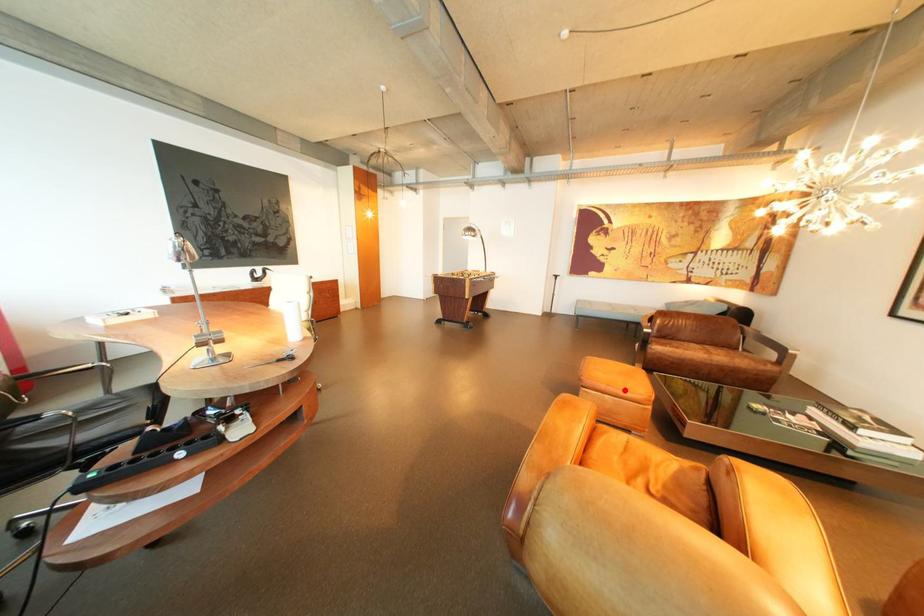
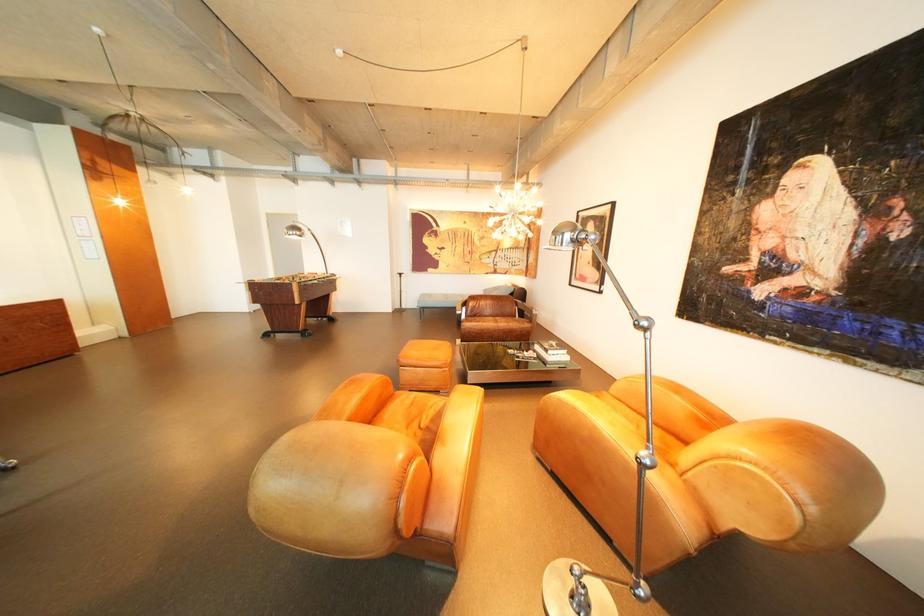
Locate, in the second image, the point that corresponds to the highlighted location in the first image.

(433, 363)